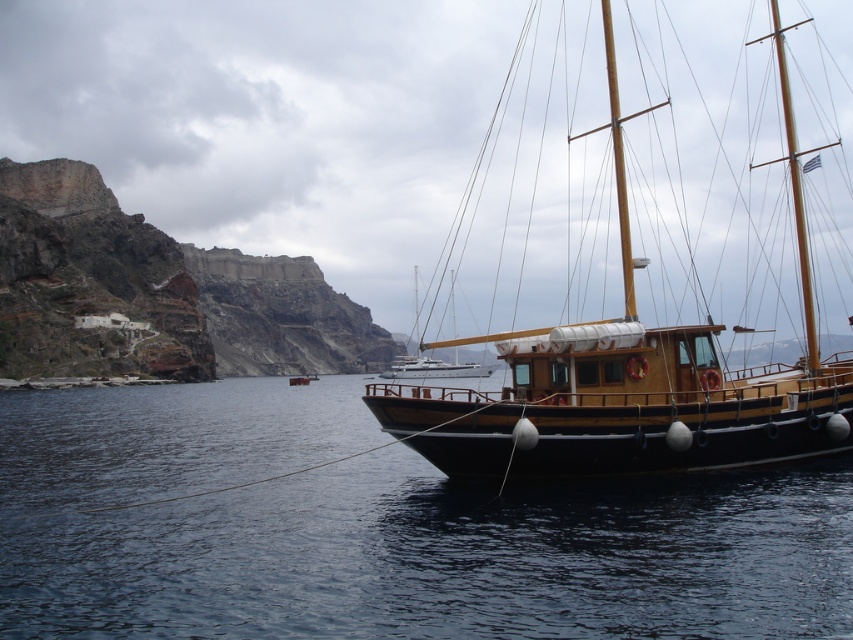
Question: Does dark blue water at lower left appear over wooden sailboat at right?

Choices:
 (A) yes
 (B) no

Answer: (B)

Question: Which point appears closest to the camera in this image?

Choices:
 (A) pos(567,605)
 (B) pos(610,364)

Answer: (A)

Question: In this image, where is dark blue water at lower left located relative to wooden sailboat at right?

Choices:
 (A) left
 (B) right

Answer: (A)

Question: Does dark blue water at lower left appear under wooden sailboat at right?

Choices:
 (A) no
 (B) yes

Answer: (B)